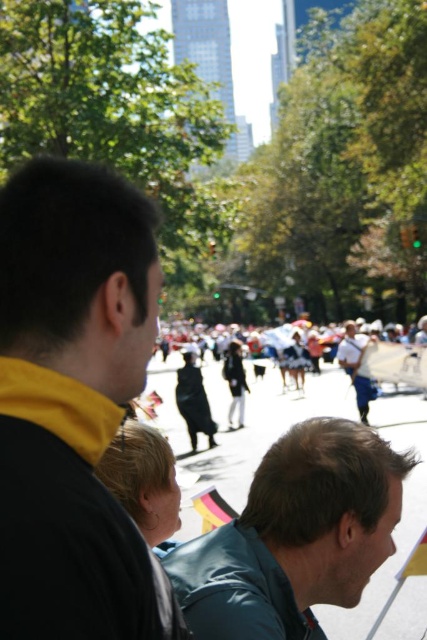
Question: Does smooth gray jacket at lower right have a smaller size compared to dark blue fabric at center?

Choices:
 (A) yes
 (B) no

Answer: (A)

Question: Which point is closer to the camera?

Choices:
 (A) (52, 298)
 (B) (225, 410)

Answer: (A)

Question: Which point is closer to the camera?

Choices:
 (A) (193, 595)
 (B) (173, 406)
 (C) (29, 184)

Answer: (C)

Question: Does black matte jacket at left have a greater width compared to smooth gray jacket at lower right?

Choices:
 (A) no
 (B) yes

Answer: (A)

Question: Which of the following is the farthest from the observer?

Choices:
 (A) (167, 416)
 (B) (297, 512)

Answer: (A)

Question: From the image, what is the correct spatial relationship of black matte jacket at left in relation to dark blue fabric at center?

Choices:
 (A) right
 (B) left

Answer: (B)